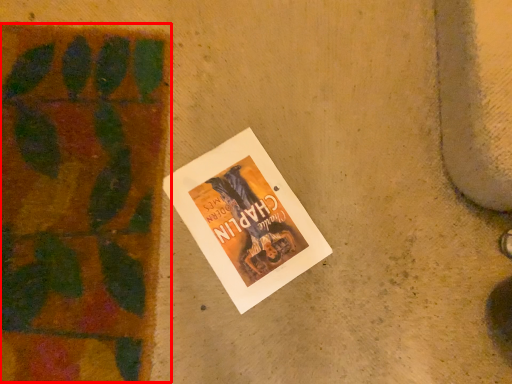
Question: From the image's perspective, where is plant (annotated by the red box) located in relation to book in the image?

Choices:
 (A) above
 (B) below

Answer: (A)